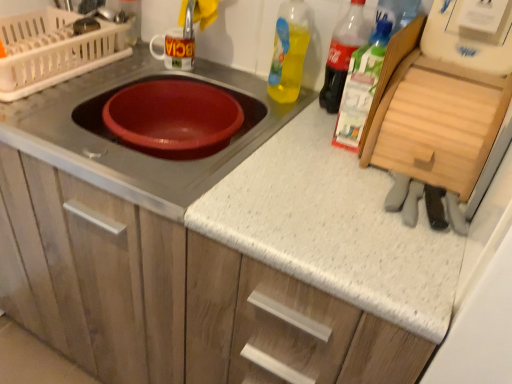
Describe the element at coordinates (53, 50) in the screenshot. This screenshot has height=384, width=512. I see `matte plastic dish drainer at upper left` at that location.

What is the approximate width of translucent plastic bottle at upper right, arranged as the 2th bottle when viewed from the left?

9.64 centimeters.

Measure the distance between matte white cabinet at center and camera.

matte white cabinet at center and camera are 22.30 inches apart.

The height and width of the screenshot is (384, 512). What are the coordinates of `translucent yellow liquid at upper right, the first bottle when ordered from left to right` in the screenshot? It's located at (289, 51).

Locate an element on the screen. The image size is (512, 384). translucent plastic bottle at upper right, which is the first bottle from right to left is located at coordinates (361, 86).

Considering the sizes of objects translucent plastic bottle at upper right, positioned as the second bottle in right-to-left order, and matte plastic dish drainer at upper left in the image provided, who is wider, translucent plastic bottle at upper right, positioned as the second bottle in right-to-left order, or matte plastic dish drainer at upper left?

With larger width is matte plastic dish drainer at upper left.

Which is in front, point (327, 108) or point (17, 96)?

The point (17, 96) is closer to the camera.

From the image's perspective, is translucent plastic bottle at upper right, arranged as the 2th bottle when viewed from the left, above or below matte plastic dish drainer at upper left?

Based on their image positions, translucent plastic bottle at upper right, arranged as the 2th bottle when viewed from the left, is located beneath matte plastic dish drainer at upper left.

Are translucent yellow liquid at upper right, the third bottle when ordered from right to left, and translucent plastic bottle at upper right, which is the first bottle from right to left, far apart?

translucent yellow liquid at upper right, the third bottle when ordered from right to left, is actually quite close to translucent plastic bottle at upper right, which is the first bottle from right to left.

Considering the sizes of objects translucent yellow liquid at upper right, the first bottle when ordered from left to right, and translucent plastic bottle at upper right, placed as the third bottle when sorted from left to right, in the image provided, who is shorter, translucent yellow liquid at upper right, the first bottle when ordered from left to right, or translucent plastic bottle at upper right, placed as the third bottle when sorted from left to right,?

translucent plastic bottle at upper right, placed as the third bottle when sorted from left to right, is shorter.

Where is `the 1st bottle above the translucent plastic bottle at upper right, which is the first bottle from right to left (from a real-world perspective)`? the 1st bottle above the translucent plastic bottle at upper right, which is the first bottle from right to left (from a real-world perspective) is located at coordinates (289, 51).

Is translucent yellow liquid at upper right, the third bottle when ordered from right to left, inside the boundaries of translucent plastic bottle at upper right, placed as the third bottle when sorted from left to right, or outside?

translucent yellow liquid at upper right, the third bottle when ordered from right to left, is spatially situated outside translucent plastic bottle at upper right, placed as the third bottle when sorted from left to right.

From the image's perspective, does translucent plastic bottle at upper right, placed as the third bottle when sorted from left to right, appear lower than matte plastic dish drainer at upper left?

Yes, from the image's perspective, translucent plastic bottle at upper right, placed as the third bottle when sorted from left to right, is below matte plastic dish drainer at upper left.

Do you think translucent plastic bottle at upper right, placed as the third bottle when sorted from left to right, is within matte plastic dish drainer at upper left, or outside of it?

translucent plastic bottle at upper right, placed as the third bottle when sorted from left to right, cannot be found inside matte plastic dish drainer at upper left.

In terms of size, does translucent plastic bottle at upper right, placed as the third bottle when sorted from left to right, appear bigger or smaller than matte plastic dish drainer at upper left?

In the image, translucent plastic bottle at upper right, placed as the third bottle when sorted from left to right, appears to be smaller than matte plastic dish drainer at upper left.

Is matte white cabinet at center facing away from matte plastic dish drainer at upper left?

matte white cabinet at center is not turned away from matte plastic dish drainer at upper left.

Who is bigger, matte white cabinet at center or matte plastic dish drainer at upper left?

matte white cabinet at center.

Is matte white cabinet at center next to matte plastic dish drainer at upper left and touching it?

There is a gap between matte white cabinet at center and matte plastic dish drainer at upper left.

Between matte white cabinet at center and matte plastic dish drainer at upper left, which one has more height?

With more height is matte white cabinet at center.

Looking at this image, what's the angular difference between translucent yellow liquid at upper right, the third bottle when ordered from right to left, and translucent plastic bottle at upper right, positioned as the second bottle in right-to-left order,'s facing directions?

The angular difference between translucent yellow liquid at upper right, the third bottle when ordered from right to left, and translucent plastic bottle at upper right, positioned as the second bottle in right-to-left order, is 1.9 degrees.

Is translucent yellow liquid at upper right, the first bottle when ordered from left to right, outside of translucent plastic bottle at upper right, positioned as the second bottle in right-to-left order?

translucent yellow liquid at upper right, the first bottle when ordered from left to right, is positioned outside translucent plastic bottle at upper right, positioned as the second bottle in right-to-left order.

In the image, is translucent yellow liquid at upper right, the first bottle when ordered from left to right, positioned in front of or behind translucent plastic bottle at upper right, arranged as the 2th bottle when viewed from the left?

In the image, translucent yellow liquid at upper right, the first bottle when ordered from left to right, appears behind translucent plastic bottle at upper right, arranged as the 2th bottle when viewed from the left.

From a real-world perspective, between translucent yellow liquid at upper right, the first bottle when ordered from left to right, and translucent plastic bottle at upper right, positioned as the second bottle in right-to-left order, who is vertically higher?

translucent plastic bottle at upper right, positioned as the second bottle in right-to-left order, from a real-world perspective.

From a real-world perspective, is matte plastic dish drainer at upper left positioned above or below matte red bowl at center?

matte plastic dish drainer at upper left is above matte red bowl at center.

Does matte plastic dish drainer at upper left have a greater width compared to matte red bowl at center?

Incorrect, the width of matte plastic dish drainer at upper left does not surpass that of matte red bowl at center.

What are the coordinates of `appliance above the matte red bowl at center (from a real-world perspective)` in the screenshot? It's located at (53, 50).

The width and height of the screenshot is (512, 384). Identify the location of cabinetry below the translucent plastic bottle at upper right, arranged as the 2th bottle when viewed from the left (from the image's perspective). (173, 296).

Considering the sizes of objects translucent plastic bottle at upper right, positioned as the second bottle in right-to-left order, and matte white cabinet at center in the image provided, who is thinner, translucent plastic bottle at upper right, positioned as the second bottle in right-to-left order, or matte white cabinet at center?

translucent plastic bottle at upper right, positioned as the second bottle in right-to-left order, is thinner.

Is translucent plastic bottle at upper right, positioned as the second bottle in right-to-left order, oriented away from matte white cabinet at center?

No.

Identify the location of appliance directly beneath the translucent plastic bottle at upper right, positioned as the second bottle in right-to-left order (from a real-world perspective). Image resolution: width=512 pixels, height=384 pixels. (53, 50).

From the image's perspective, count 2nd bottles upward from the translucent plastic bottle at upper right, which is the first bottle from right to left, and point to it. Please provide its 2D coordinates.

[(289, 51)]

From the picture: Considering their positions, is translucent plastic bottle at upper right, placed as the third bottle when sorted from left to right, positioned closer to matte white cabinet at center than matte plastic dish drainer at upper left?

matte plastic dish drainer at upper left is positioned closer to the anchor matte white cabinet at center.

Looking at the image, which one is located further to matte plastic dish drainer at upper left, translucent plastic bottle at upper right, positioned as the second bottle in right-to-left order, or matte red bowl at center?

The object further to matte plastic dish drainer at upper left is translucent plastic bottle at upper right, positioned as the second bottle in right-to-left order.

Looking at the image, which one is located closer to translucent plastic bottle at upper right, which is the first bottle from right to left, translucent plastic bottle at upper right, arranged as the 2th bottle when viewed from the left, or matte red bowl at center?

translucent plastic bottle at upper right, arranged as the 2th bottle when viewed from the left.

Which object lies nearer to the anchor point translucent yellow liquid at upper right, the third bottle when ordered from right to left, matte plastic dish drainer at upper left or matte white cabinet at center?

Among the two, matte plastic dish drainer at upper left is located nearer to translucent yellow liquid at upper right, the third bottle when ordered from right to left.

Based on their spatial positions, is matte white cabinet at center or translucent plastic bottle at upper right, positioned as the second bottle in right-to-left order, further from translucent plastic bottle at upper right, placed as the third bottle when sorted from left to right?

matte white cabinet at center is further to translucent plastic bottle at upper right, placed as the third bottle when sorted from left to right.

In the scene shown: When comparing their distances from translucent yellow liquid at upper right, the first bottle when ordered from left to right, does matte plastic dish drainer at upper left or translucent plastic bottle at upper right, placed as the third bottle when sorted from left to right, seem closer?

translucent plastic bottle at upper right, placed as the third bottle when sorted from left to right.

From the image, which object appears to be nearer to translucent plastic bottle at upper right, positioned as the second bottle in right-to-left order, translucent yellow liquid at upper right, the third bottle when ordered from right to left, or translucent plastic bottle at upper right, which is the first bottle from right to left?

Among the two, translucent plastic bottle at upper right, which is the first bottle from right to left, is located nearer to translucent plastic bottle at upper right, positioned as the second bottle in right-to-left order.

Estimate the real-world distances between objects in this image. Which object is further from matte plastic dish drainer at upper left, matte red bowl at center or translucent plastic bottle at upper right, which is the first bottle from right to left?

Based on the image, translucent plastic bottle at upper right, which is the first bottle from right to left, appears to be further to matte plastic dish drainer at upper left.

Identify the location of cabinetry located between matte red bowl at center and translucent plastic bottle at upper right, which is the first bottle from right to left, in the left-right direction. (173, 296).

The width and height of the screenshot is (512, 384). Identify the location of bottle between matte red bowl at center and translucent plastic bottle at upper right, arranged as the 2th bottle when viewed from the left, in the horizontal direction. (289, 51).

The width and height of the screenshot is (512, 384). I want to click on bottle located between matte plastic dish drainer at upper left and translucent plastic bottle at upper right, positioned as the second bottle in right-to-left order, in the left-right direction, so click(x=289, y=51).

This screenshot has height=384, width=512. In order to click on cabinetry situated between matte plastic dish drainer at upper left and translucent plastic bottle at upper right, which is the first bottle from right to left, from left to right in this screenshot , I will do `click(173, 296)`.